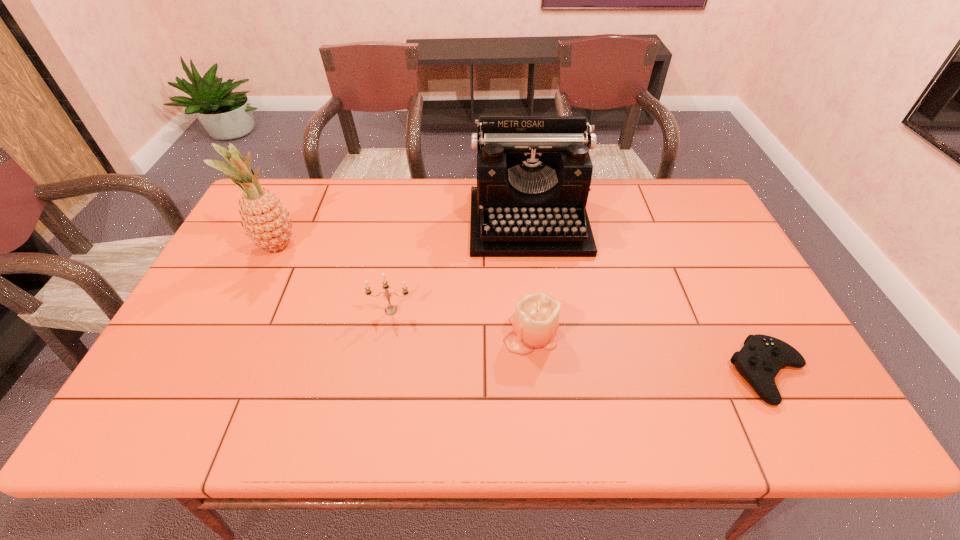
Find the location of a particular element. the leftmost object is located at coordinates (266, 222).

The height and width of the screenshot is (540, 960). I want to click on pineapple, so click(x=266, y=222).

Identify the location of typewriter. (534, 173).

Find the location of `the right candle`. the right candle is located at coordinates (535, 321).

Find the location of `the second object from left to right`. the second object from left to right is located at coordinates (390, 309).

Where is `control`? The image size is (960, 540). control is located at coordinates (761, 358).

The width and height of the screenshot is (960, 540). Identify the location of the shortest object. (761, 358).

What are the coordinates of `free spot located 0.330m on the front of the leftmost object` in the screenshot? It's located at (222, 358).

Identify the location of vacant region located on the typing side of the typewriter. This screenshot has height=540, width=960. (543, 339).

Locate an element on the screen. The height and width of the screenshot is (540, 960). free space located 0.050m on the front of the right candle is located at coordinates (536, 374).